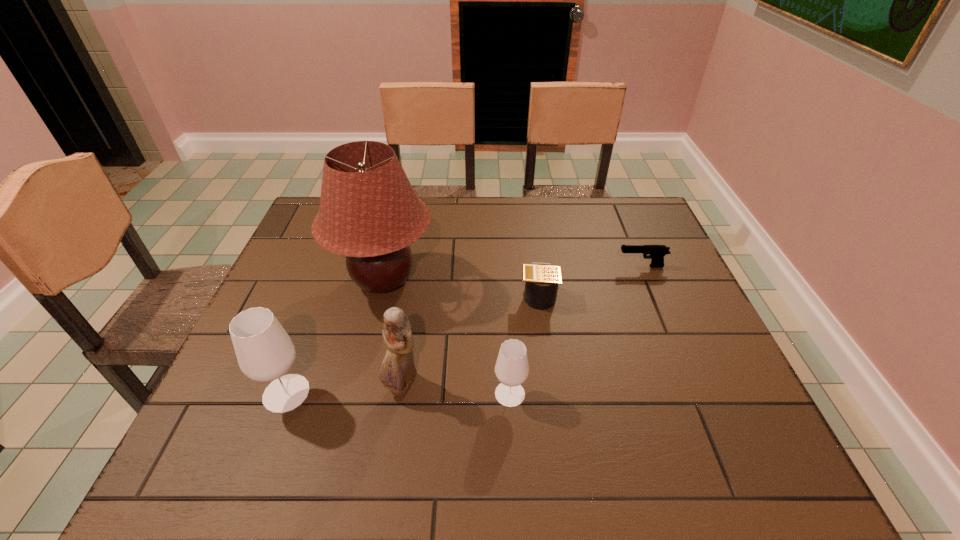
You are a GUI agent. You are given a task and a screenshot of the screen. Output one action in this format:
    pyautogui.click(x=<x>, y=<y>)
    Task: Click on the left glass
    
    Given the screenshot: What is the action you would take?
    pyautogui.click(x=265, y=352)

Where is `the fourth tallest object`? the fourth tallest object is located at coordinates (511, 369).

Find the location of a particular element. The image size is (960, 540). the right glass is located at coordinates (511, 369).

The width and height of the screenshot is (960, 540). I want to click on pistol, so click(657, 252).

Identify the location of the rightmost object. The image size is (960, 540). (657, 252).

The width and height of the screenshot is (960, 540). Identify the location of calculator. (541, 280).

Image resolution: width=960 pixels, height=540 pixels. Identify the location of the tallest object. (369, 212).

You are a GUI agent. You are given a task and a screenshot of the screen. Output one action in this format:
    pyautogui.click(x=<x>, y=<y>)
    Task: Click on the figurine
    
    Given the screenshot: What is the action you would take?
    pyautogui.click(x=398, y=371)

At what (x,y) coordinates should I click in order to perform the action: click on free region located 0.070m on the back of the taller glass. Please return your answer as a coordinate pair (x, y). The height and width of the screenshot is (540, 960). Looking at the image, I should click on (303, 348).

Identify the location of free space located 0.330m on the right of the shorter glass. (680, 394).